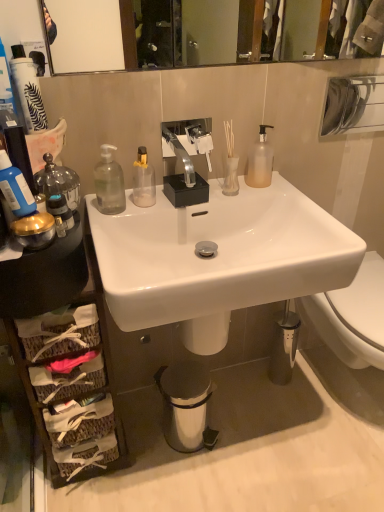
Question: Is metallic trash can at lower center turned away from translucent glass vase at upper center?

Choices:
 (A) no
 (B) yes

Answer: (A)

Question: Is metallic trash can at lower center at the left side of translucent glass vase at upper center?

Choices:
 (A) yes
 (B) no

Answer: (A)

Question: Does metallic trash can at lower center have a greater height compared to translucent glass vase at upper center?

Choices:
 (A) no
 (B) yes

Answer: (B)

Question: From a real-world perspective, is metallic trash can at lower center beneath translucent glass vase at upper center?

Choices:
 (A) yes
 (B) no

Answer: (A)

Question: From a real-world perspective, does metallic trash can at lower center stand above translucent glass vase at upper center?

Choices:
 (A) yes
 (B) no

Answer: (B)

Question: Does metallic trash can at lower center have a greater width compared to translucent glass vase at upper center?

Choices:
 (A) no
 (B) yes

Answer: (B)

Question: Is woven wood basket at lower left taller than white glossy sink at center, acting as the first sink starting from the bottom?

Choices:
 (A) yes
 (B) no

Answer: (A)

Question: Considering the relative sizes of woven wood basket at lower left and white glossy sink at center, acting as the first sink starting from the bottom, in the image provided, is woven wood basket at lower left shorter than white glossy sink at center, acting as the first sink starting from the bottom,?

Choices:
 (A) no
 (B) yes

Answer: (A)

Question: From the image's perspective, is woven wood basket at lower left on top of white glossy sink at center, which is the 2th sink from top to bottom?

Choices:
 (A) yes
 (B) no

Answer: (B)

Question: Is woven wood basket at lower left wider than white glossy sink at center, which is the 2th sink from top to bottom?

Choices:
 (A) no
 (B) yes

Answer: (A)

Question: Considering the relative sizes of woven wood basket at lower left and white glossy sink at center, acting as the first sink starting from the bottom, in the image provided, is woven wood basket at lower left bigger than white glossy sink at center, acting as the first sink starting from the bottom,?

Choices:
 (A) yes
 (B) no

Answer: (B)

Question: Is woven wood basket at lower left touching white glossy sink at center, acting as the first sink starting from the bottom?

Choices:
 (A) yes
 (B) no

Answer: (B)

Question: Is metallic trash can at lower center surrounding white frosted glass vase at upper center?

Choices:
 (A) no
 (B) yes

Answer: (A)